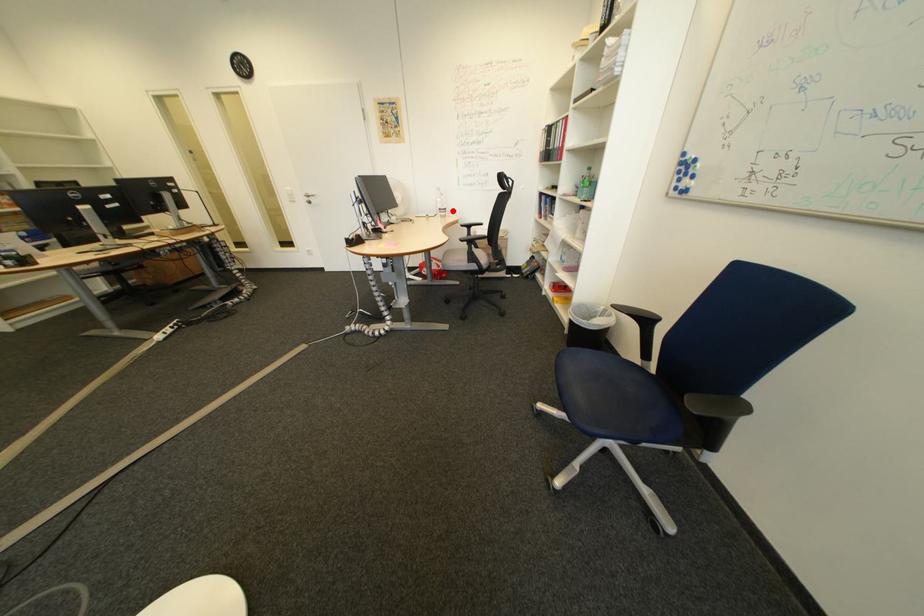
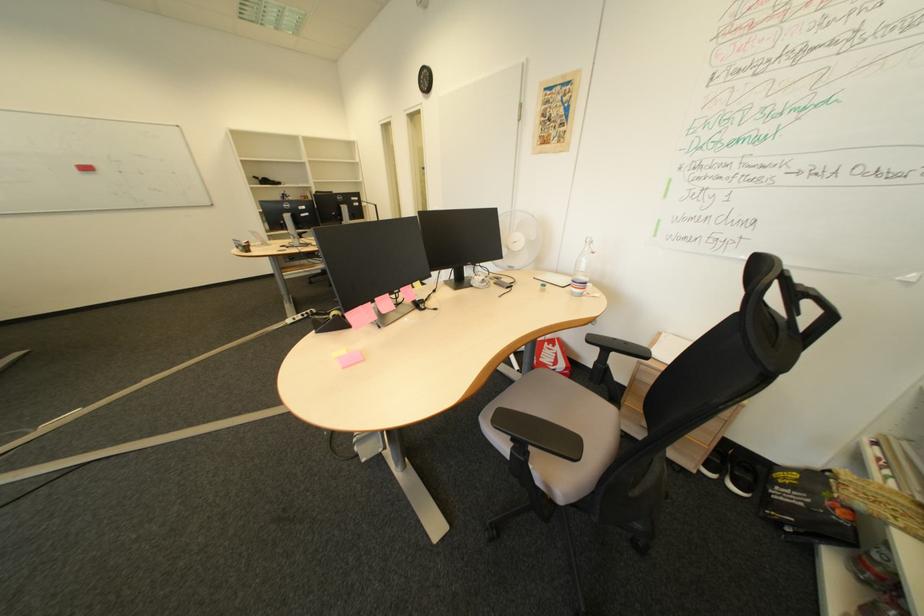
Find the pixel in the second image that matches the highlighted location in the first image.

(587, 282)